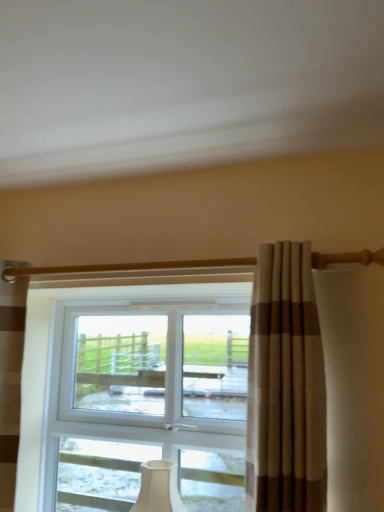
The image size is (384, 512). I want to click on white matte table lamp at center, so click(x=158, y=488).

At what (x,y) coordinates should I click in order to perform the action: click on beige striped curtain at center, which is counted as the second curtain, starting from the left. Please return your answer as a coordinate pair (x, y). Looking at the image, I should click on (285, 385).

Does white matte table lamp at center have a larger size compared to beige striped curtain at center, the first curtain positioned from the right?

No.

Can you confirm if white matte table lamp at center is thinner than beige striped curtain at center, which is the 1th curtain from front to back?

Correct, the width of white matte table lamp at center is less than that of beige striped curtain at center, which is the 1th curtain from front to back.

Consider the image. Visually, is white matte table lamp at center positioned to the left or to the right of beige striped curtain at center, the first curtain positioned from the right?

Based on their positions, white matte table lamp at center is located to the left of beige striped curtain at center, the first curtain positioned from the right.

Is white matte table lamp at center turned away from beige striped curtain at center, which is counted as the second curtain, starting from the back?

No, white matte table lamp at center is not facing the opposite direction of beige striped curtain at center, which is counted as the second curtain, starting from the back.

Looking at the image, does beige striped curtain at center, which is counted as the second curtain, starting from the back, seem bigger or smaller compared to white matte table lamp at center?

Considering their sizes, beige striped curtain at center, which is counted as the second curtain, starting from the back, takes up more space than white matte table lamp at center.

Between point (261, 445) and point (151, 489), which one is positioned in front?

Positioned in front is point (261, 445).

Is beige striped curtain at center, which is the 1th curtain from front to back, wider or thinner than white matte table lamp at center?

Considering their sizes, beige striped curtain at center, which is the 1th curtain from front to back, looks broader than white matte table lamp at center.

Does beige striped curtain at center, the first curtain positioned from the right, appear on the left side of white matte table lamp at center?

Incorrect, beige striped curtain at center, the first curtain positioned from the right, is not on the left side of white matte table lamp at center.

Considering the positions of objects brown striped curtain at left, which is counted as the 1th curtain, starting from the back, and white matte table lamp at center in the image provided, who is more to the left, brown striped curtain at left, which is counted as the 1th curtain, starting from the back, or white matte table lamp at center?

brown striped curtain at left, which is counted as the 1th curtain, starting from the back, is more to the left.

In the scene shown: Is brown striped curtain at left, placed as the second curtain when sorted from front to back, facing away from white matte table lamp at center?

No, white matte table lamp at center is not at the back of brown striped curtain at left, placed as the second curtain when sorted from front to back.

Does brown striped curtain at left, placed as the second curtain when sorted from front to back, have a smaller size compared to white matte table lamp at center?

No.

From a real-world perspective, which object rests below the other?

white matte table lamp at center, from a real-world perspective.

Considering the positions of points (6, 438) and (281, 268), is point (6, 438) farther from camera compared to point (281, 268)?

Yes, it is.

Could you tell me if brown striped curtain at left, which is counted as the 1th curtain, starting from the back, is turned towards beige striped curtain at center, the first curtain positioned from the right?

No, brown striped curtain at left, which is counted as the 1th curtain, starting from the back, does not turn towards beige striped curtain at center, the first curtain positioned from the right.

Is brown striped curtain at left, which is counted as the 1th curtain, starting from the back, completely or partially outside of beige striped curtain at center, the first curtain positioned from the right?

Yes, brown striped curtain at left, which is counted as the 1th curtain, starting from the back, is outside of beige striped curtain at center, the first curtain positioned from the right.

I want to click on curtain that appears on the left of beige striped curtain at center, the first curtain positioned from the right, so click(10, 376).

Between beige striped curtain at center, the first curtain positioned from the right, and brown striped curtain at left, placed as the second curtain when sorted from front to back, which one has more height?

With more height is brown striped curtain at left, placed as the second curtain when sorted from front to back.

From the image's perspective, would you say beige striped curtain at center, the first curtain positioned from the right, is positioned over brown striped curtain at left, marked as the 2th curtain in a right-to-left arrangement?

Yes.

Is beige striped curtain at center, the first curtain positioned from the right, bigger than brown striped curtain at left, which is counted as the 1th curtain, starting from the back?

Yes, beige striped curtain at center, the first curtain positioned from the right, is bigger than brown striped curtain at left, which is counted as the 1th curtain, starting from the back.

Considering the relative sizes of beige striped curtain at center, which is counted as the second curtain, starting from the back, and brown striped curtain at left, marked as the 1th curtain in a left-to-right arrangement, in the image provided, is beige striped curtain at center, which is counted as the second curtain, starting from the back, wider than brown striped curtain at left, marked as the 1th curtain in a left-to-right arrangement,?

Correct, the width of beige striped curtain at center, which is counted as the second curtain, starting from the back, exceeds that of brown striped curtain at left, marked as the 1th curtain in a left-to-right arrangement.

Could you measure the distance between white matte table lamp at center and brown striped curtain at left, placed as the second curtain when sorted from front to back?

white matte table lamp at center and brown striped curtain at left, placed as the second curtain when sorted from front to back, are 23.80 inches apart from each other.

Is white matte table lamp at center looking in the opposite direction of brown striped curtain at left, placed as the second curtain when sorted from front to back?

No, white matte table lamp at center's orientation is not away from brown striped curtain at left, placed as the second curtain when sorted from front to back.

Between point (144, 504) and point (8, 359), which one is positioned in front?

The point (8, 359) is more forward.

This screenshot has width=384, height=512. What are the coordinates of `table lamp to the right of brown striped curtain at left, which is counted as the 1th curtain, starting from the back` in the screenshot? It's located at (158, 488).

The height and width of the screenshot is (512, 384). I want to click on the 2nd curtain directly above the white matte table lamp at center (from a real-world perspective), so click(285, 385).

Identify the location of the 2nd curtain in front of the white matte table lamp at center, starting your count from the anchor. Image resolution: width=384 pixels, height=512 pixels. (285, 385).

Estimate the real-world distances between objects in this image. Which object is closer to beige striped curtain at center, which is counted as the second curtain, starting from the back, brown striped curtain at left, marked as the 2th curtain in a right-to-left arrangement, or white matte table lamp at center?

Based on the image, white matte table lamp at center appears to be nearer to beige striped curtain at center, which is counted as the second curtain, starting from the back.

Based on their spatial positions, is beige striped curtain at center, which is counted as the second curtain, starting from the left, or brown striped curtain at left, marked as the 1th curtain in a left-to-right arrangement, further from white matte table lamp at center?

Among the two, beige striped curtain at center, which is counted as the second curtain, starting from the left, is located further to white matte table lamp at center.

Which object lies further to the anchor point white matte table lamp at center, brown striped curtain at left, placed as the second curtain when sorted from front to back, or beige striped curtain at center, the first curtain positioned from the right?

beige striped curtain at center, the first curtain positioned from the right, is positioned further to the anchor white matte table lamp at center.

Based on their spatial positions, is white matte table lamp at center or beige striped curtain at center, which is counted as the second curtain, starting from the left, further from brown striped curtain at left, placed as the second curtain when sorted from front to back?

beige striped curtain at center, which is counted as the second curtain, starting from the left.

Looking at the image, which one is located closer to beige striped curtain at center, which is counted as the second curtain, starting from the left, white matte table lamp at center or brown striped curtain at left, placed as the second curtain when sorted from front to back?

Based on the image, white matte table lamp at center appears to be nearer to beige striped curtain at center, which is counted as the second curtain, starting from the left.

Estimate the real-world distances between objects in this image. Which object is further from brown striped curtain at left, placed as the second curtain when sorted from front to back, beige striped curtain at center, which is counted as the second curtain, starting from the back, or white matte table lamp at center?

beige striped curtain at center, which is counted as the second curtain, starting from the back, is positioned further to the anchor brown striped curtain at left, placed as the second curtain when sorted from front to back.

Find the location of a particular element. The image size is (384, 512). table lamp between brown striped curtain at left, marked as the 2th curtain in a right-to-left arrangement, and beige striped curtain at center, which is counted as the second curtain, starting from the left, in the horizontal direction is located at coordinates (158, 488).